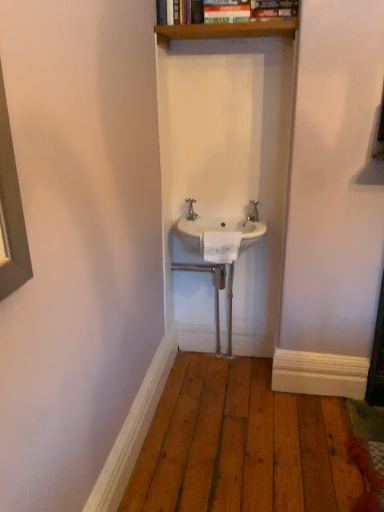
Image resolution: width=384 pixels, height=512 pixels. I want to click on free spot above white ceramic sink at center (from a real-world perspective), so click(223, 219).